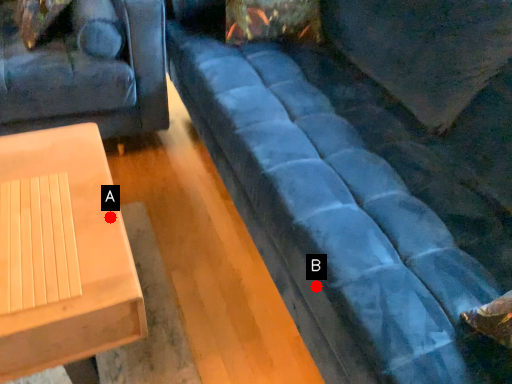
Question: Two points are circled on the image, labeled by A and B beside each circle. Which point is further to the camera?

Choices:
 (A) A is further
 (B) B is further

Answer: (A)